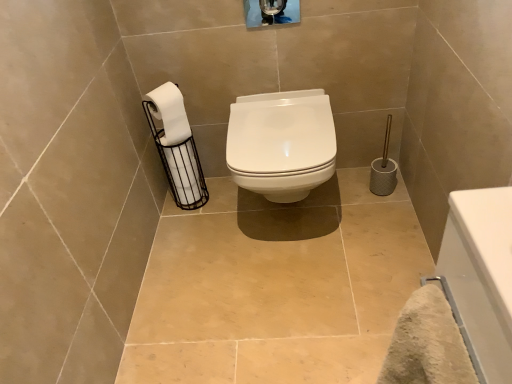
Question: Is white matte toilet paper at left, which is counted as the second toilet paper, starting from the back, wider or thinner than white glossy bathtub at lower right?

Choices:
 (A) thin
 (B) wide

Answer: (A)

Question: Is point (169, 107) closer or farther from the camera than point (460, 274)?

Choices:
 (A) farther
 (B) closer

Answer: (A)

Question: Which is nearer to the white glossy toilet at center?

Choices:
 (A) white matte toilet paper at left, positioned as the 1th toilet paper in back-to-front order
 (B) white glossy bathtub at lower right
 (C) white matte toilet paper at left, which is counted as the second toilet paper, starting from the back

Answer: (A)

Question: Which of these objects is positioned closest to the white matte toilet paper at left, the 2th toilet paper viewed from the front?

Choices:
 (A) white matte toilet paper at left, which is counted as the second toilet paper, starting from the back
 (B) white glossy bathtub at lower right
 (C) white glossy toilet at center

Answer: (A)